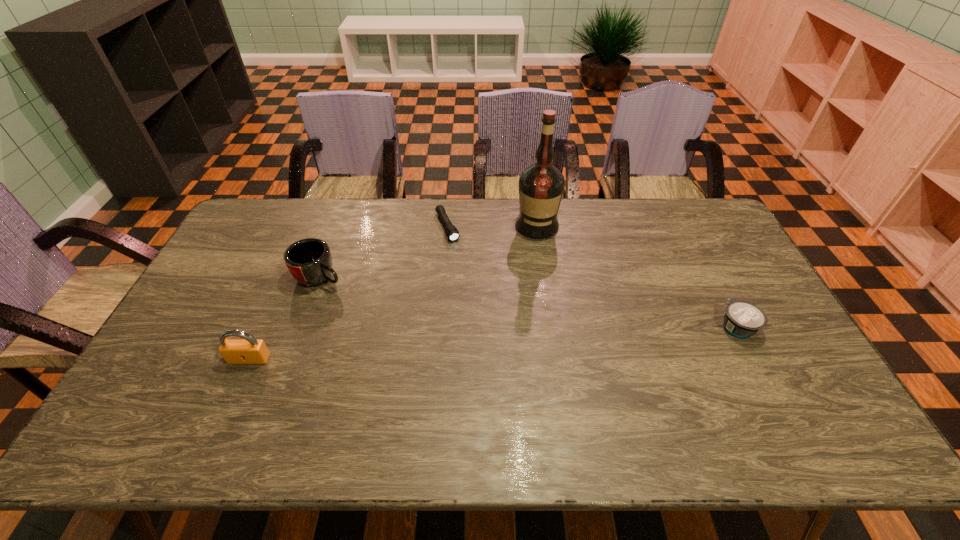
At what (x,y) coordinates should I click in order to perform the action: click on flashlight located in the far edge section of the desktop. Please return your answer as a coordinate pair (x, y). Image resolution: width=960 pixels, height=540 pixels. Looking at the image, I should click on (451, 231).

This screenshot has width=960, height=540. In order to click on object present at the right edge in this screenshot , I will do `click(742, 319)`.

Identify the location of vacant space at the far edge. Image resolution: width=960 pixels, height=540 pixels. (500, 234).

Where is `vacant space at the near edge`? vacant space at the near edge is located at coordinates (673, 377).

What are the coordinates of `free space at the left edge of the desktop` in the screenshot? It's located at (242, 288).

You are a GUI agent. You are given a task and a screenshot of the screen. Output one action in this format:
    pyautogui.click(x=<x>, y=<y>)
    Task: Click on the vacant space at the right edge
    
    Given the screenshot: What is the action you would take?
    pyautogui.click(x=728, y=275)

Locate an element on the screen. Image resolution: width=960 pixels, height=540 pixels. free area in between the nearest object and the fourth farthest object is located at coordinates (493, 343).

Locate an element on the screen. This screenshot has width=960, height=540. free space between the mug and the nearest object is located at coordinates (285, 318).

At what (x,y) coordinates should I click in order to perform the action: click on blank region between the flashlight and the liquor. Please return your answer as a coordinate pair (x, y). The image size is (960, 540). Looking at the image, I should click on (492, 226).

In order to click on vacant area that lies between the second object from right to left and the mug in this screenshot , I will do `click(428, 251)`.